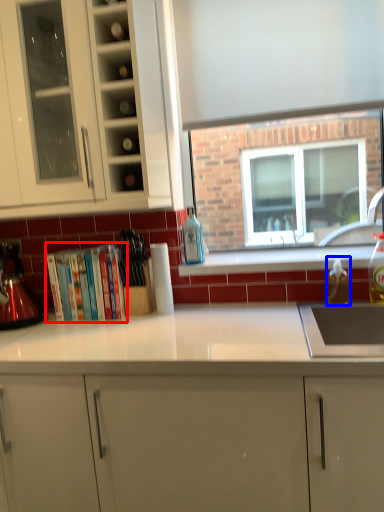
Question: Among these objects, which one is farthest to the camera, book (highlighted by a red box) or bottle (highlighted by a blue box)?

Choices:
 (A) book
 (B) bottle

Answer: (A)